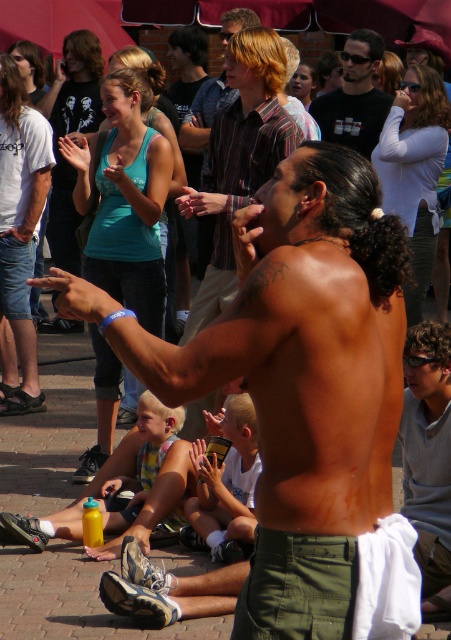
Question: Which object is closer to the camera taking this photo?

Choices:
 (A) black t-shirt at center
 (B) matte gray shirt at center
 (C) shiny skin at center

Answer: (C)

Question: Does shiny skin at center appear under black t-shirt at center?

Choices:
 (A) yes
 (B) no

Answer: (A)

Question: Can you confirm if shiny skin at center is positioned below matte gray shirt at center?

Choices:
 (A) yes
 (B) no

Answer: (B)

Question: Which point is closer to the camera?

Choices:
 (A) matte gray shirt at center
 (B) black t-shirt at center

Answer: (A)

Question: Is shiny skin at center to the right of black t-shirt at center from the viewer's perspective?

Choices:
 (A) no
 (B) yes

Answer: (A)

Question: Which object is closer to the camera taking this photo?

Choices:
 (A) black t-shirt at center
 (B) matte gray shirt at center

Answer: (B)